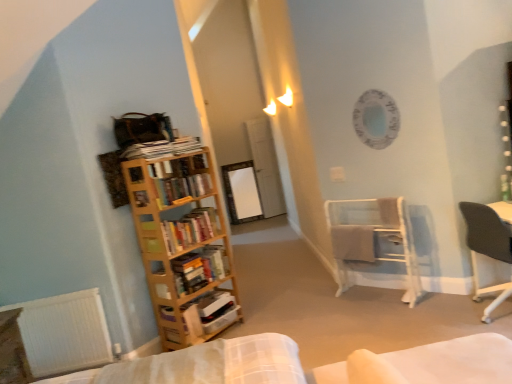
Question: Considering the positions of point (219, 296) and point (128, 182), is point (219, 296) closer or farther from the camera than point (128, 182)?

Choices:
 (A) closer
 (B) farther

Answer: (B)

Question: Looking at their shapes, would you say white cardboard box at left, which is the 1th book in bottom-to-top order, is wider or thinner than wooden bookcase at left?

Choices:
 (A) thin
 (B) wide

Answer: (A)

Question: Which object is the farthest from the white metal towel rack at center right?

Choices:
 (A) transparent glass door at center
 (B) wooden bookcase at left
 (C) hardcover books at left, which is the second book in top-to-bottom order
 (D) white cardboard box at left, which is the 1th book in bottom-to-top order
 (E) dark gray fabric chair at right

Answer: (A)

Question: Which object is the farthest from the wooden bookshelf at left, the 3th book when ordered from top to bottom?

Choices:
 (A) wooden bookshelf at left, placed as the 4th book when sorted from bottom to top
 (B) transparent glass door at center
 (C) wooden bookcase at left
 (D) wooden table at lower left
 (E) white metal towel rack at center right

Answer: (B)